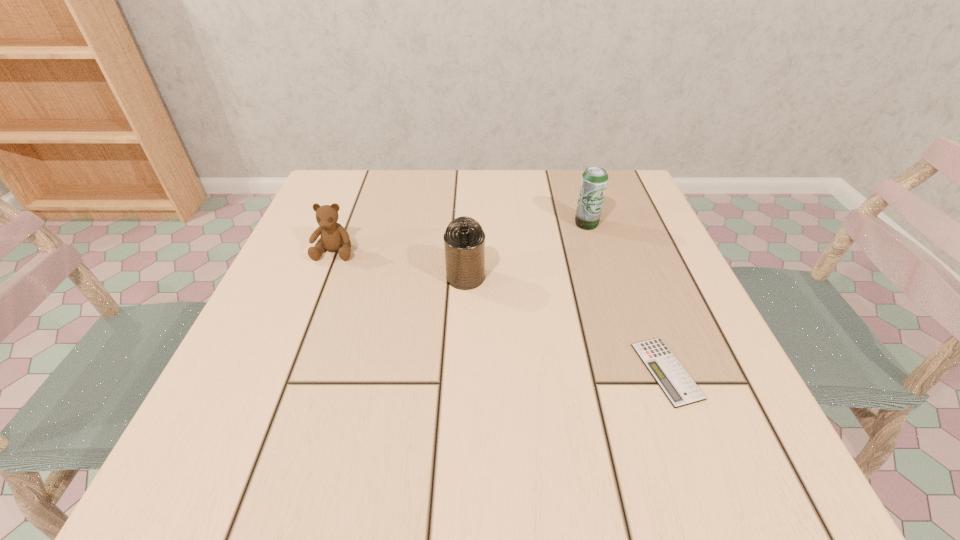
Identify the location of free space between the second shortest object and the calculator. The width and height of the screenshot is (960, 540). (501, 311).

Locate an element on the screen. The width and height of the screenshot is (960, 540). free space that is in between the farthest object and the can is located at coordinates (526, 251).

Identify which object is located as the third nearest to the shortest object. Please provide its 2D coordinates. Your answer should be formatted as a tuple, i.e. [(x, y)], where the tuple contains the x and y coordinates of a point satisfying the conditions above.

[(334, 237)]

Identify which object is the second nearest to the second object from left to right. Please provide its 2D coordinates. Your answer should be formatted as a tuple, i.e. [(x, y)], where the tuple contains the x and y coordinates of a point satisfying the conditions above.

[(594, 180)]

Image resolution: width=960 pixels, height=540 pixels. Find the location of `vacant space that satisfies the following two spatial constraints: 1. on the front-facing side of the second shortest object; 2. on the left side of the calculator`. vacant space that satisfies the following two spatial constraints: 1. on the front-facing side of the second shortest object; 2. on the left side of the calculator is located at coordinates (288, 371).

At what (x,y) coordinates should I click in order to perform the action: click on vacant space that satisfies the following two spatial constraints: 1. on the front-facing side of the third object from right to left; 2. on the right side of the second shortest object. Please return your answer as a coordinate pair (x, y). Image resolution: width=960 pixels, height=540 pixels. Looking at the image, I should click on (324, 277).